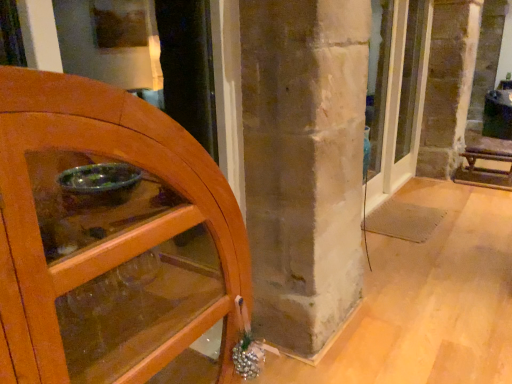
Question: From their relative heights in the image, would you say wooden bench at right is taller or shorter than wooden cabinet at left, the 2th door in the back-to-front sequence?

Choices:
 (A) tall
 (B) short

Answer: (B)

Question: Based on their positions, is wooden bench at right located to the left or right of wooden cabinet at left, the 2th door in the back-to-front sequence?

Choices:
 (A) left
 (B) right

Answer: (B)

Question: Which of these objects is positioned farthest from the wooden bench at right?

Choices:
 (A) matte glass door at center, the second door from the front
 (B) wooden cabinet at left, the 1th door viewed from the front

Answer: (B)

Question: Which object is positioned farthest from the wooden bench at right?

Choices:
 (A) matte glass door at center, which is the 1th door in back-to-front order
 (B) wooden cabinet at left, the 2th door in the back-to-front sequence

Answer: (B)